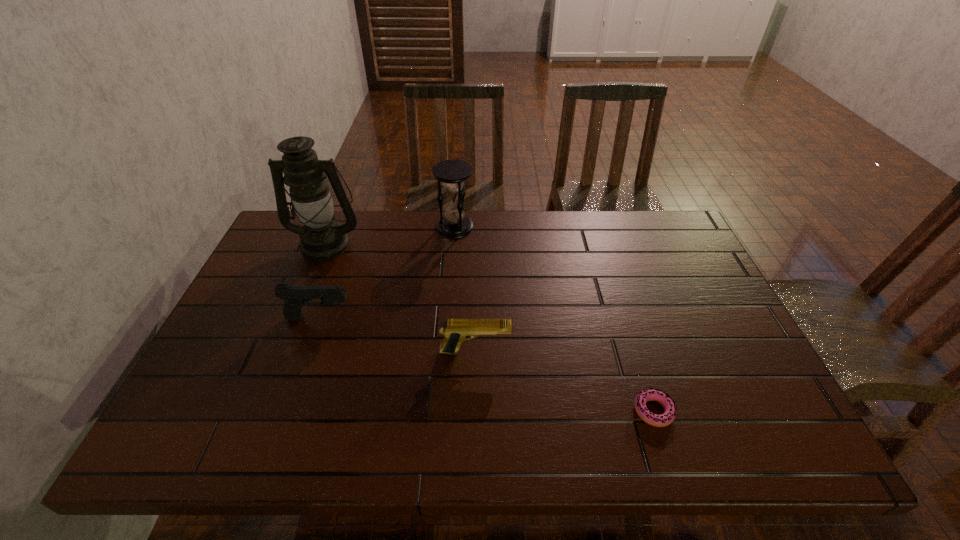
Identify the location of the tallest object. Image resolution: width=960 pixels, height=540 pixels. (322, 237).

You are a GUI agent. You are given a task and a screenshot of the screen. Output one action in this format:
    pyautogui.click(x=<x>, y=<y>)
    Task: Click on the hourglass
    The width and height of the screenshot is (960, 540).
    Given the screenshot: What is the action you would take?
    pyautogui.click(x=452, y=173)

Locate an element on the screen. the left pistol is located at coordinates (295, 297).

Locate an element on the screen. The height and width of the screenshot is (540, 960). the third farthest object is located at coordinates (295, 297).

Find the location of a particular element. This screenshot has height=540, width=960. the nearer pistol is located at coordinates (456, 331).

Locate an element on the screen. This screenshot has height=540, width=960. the second nearest object is located at coordinates (456, 331).

The width and height of the screenshot is (960, 540). Identify the location of the nearest object. coord(664,399).

Find the location of `the rightmost object`. the rightmost object is located at coordinates tap(664, 399).

You are a GUI agent. You are given a task and a screenshot of the screen. Output one action in this format:
    pyautogui.click(x=<x>, y=<y>)
    Task: Click on the vacant region located on the left of the oil lamp
    The width and height of the screenshot is (960, 540).
    Given the screenshot: What is the action you would take?
    pyautogui.click(x=271, y=243)

Identify the location of vacant space located 0.150m on the right of the second tallest object. The width and height of the screenshot is (960, 540). (518, 227).